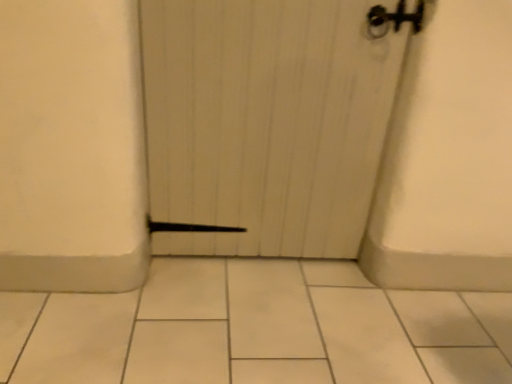
Image resolution: width=512 pixels, height=384 pixels. Identify the location of white wood door at center. (269, 119).

This screenshot has height=384, width=512. Describe the element at coordinates (269, 119) in the screenshot. I see `white wood door at center` at that location.

Looking at this image, what is the approximate width of white wood door at center?

It is 3.99 inches.

Locate an element on the screen. white wood door at center is located at coordinates (269, 119).